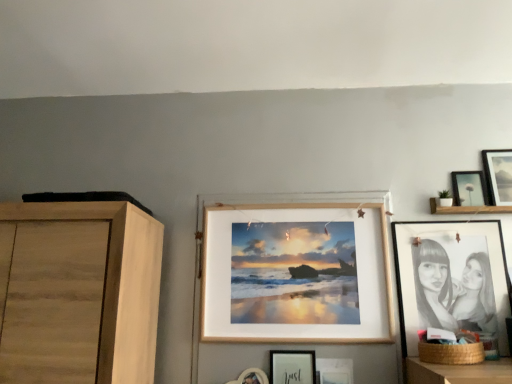
Question: Is wooden frame at center, arranged as the 2th picture frame when viewed from the left, wider or thinner than matte black picture frame at upper right, arranged as the 1th picture frame when viewed from the right?

Choices:
 (A) thin
 (B) wide

Answer: (B)

Question: From the image's perspective, is wooden frame at center, arranged as the 2th picture frame when viewed from the left, located above or below matte black picture frame at upper right, arranged as the 1th picture frame when viewed from the right?

Choices:
 (A) above
 (B) below

Answer: (B)

Question: Which object is the closest to the wooden frame at center, arranged as the 2th picture frame when viewed from the left?

Choices:
 (A) black paper portrait at right, marked as the 3th picture frame in a right-to-left arrangement
 (B) matte black picture frame at upper right, arranged as the 1th picture frame when viewed from the right
 (C) matte black picture frame at upper right, the 2th picture frame positioned from the right
 (D) matte white picture frame at center, which is the 6th picture frame from right to left
 (E) matte wooden picture frame at center, acting as the third picture frame starting from the left

Answer: (D)

Question: Considering the real-world distances, which object is farthest from the matte black picture frame at upper right, placed as the 6th picture frame when sorted from left to right?

Choices:
 (A) wooden frame at center, arranged as the 2th picture frame when viewed from the left
 (B) matte black picture frame at upper right, the 2th picture frame positioned from the right
 (C) matte wooden picture frame at center, marked as the fourth picture frame in a right-to-left arrangement
 (D) brown woven basket at lower right
 (E) matte white picture frame at center, acting as the 1th picture frame starting from the left

Answer: (E)